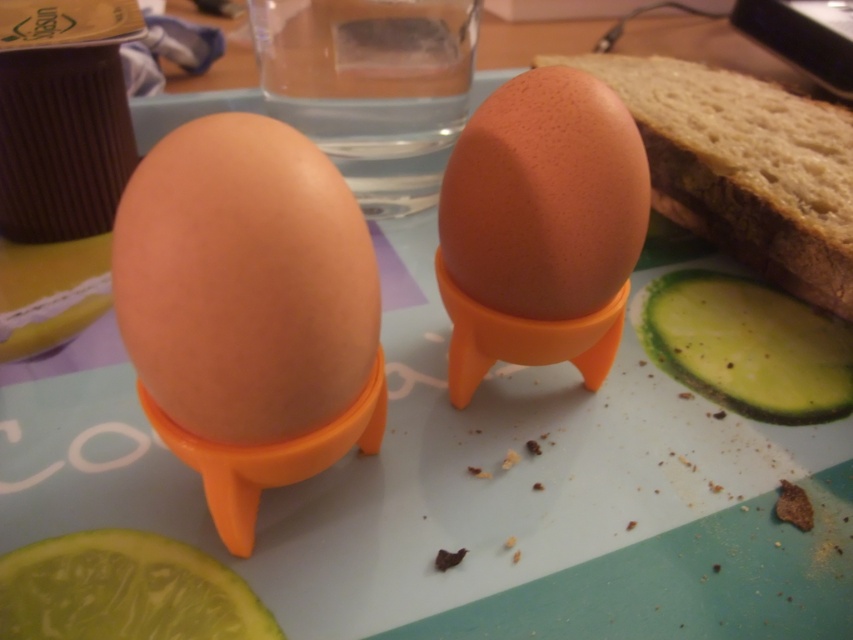
Locate an element on the screen. matte brown egg at center is located at coordinates (244, 282).

Is matte brown egg at center taller than green matte pickle at lower left?

Yes, matte brown egg at center is taller than green matte pickle at lower left.

At what (x,y) coordinates should I click in order to perform the action: click on matte brown egg at center. Please return your answer as a coordinate pair (x, y). The image size is (853, 640). Looking at the image, I should click on (244, 282).

You are a GUI agent. You are given a task and a screenshot of the screen. Output one action in this format:
    pyautogui.click(x=<x>, y=<y>)
    Task: Click on the matte brown egg at center
    The height and width of the screenshot is (640, 853).
    Given the screenshot: What is the action you would take?
    pyautogui.click(x=244, y=282)

Is brown matte egg at center shorter than green matte pickle at lower left?

No.

Does brown matte egg at center lie behind green matte pickle at lower left?

That is True.

The image size is (853, 640). I want to click on brown matte egg at center, so click(544, 196).

Where is `brown matte egg at center`? This screenshot has width=853, height=640. brown matte egg at center is located at coordinates (544, 196).

Can you confirm if brown matte egg at center is bigger than brown matte bread at upper right?

Incorrect, brown matte egg at center is not larger than brown matte bread at upper right.

Which is below, brown matte egg at center or brown matte bread at upper right?

Positioned lower is brown matte egg at center.

Does point (482, 252) lie behind point (843, 268)?

No, (482, 252) is closer to viewer.

Identify the location of brown matte egg at center. The width and height of the screenshot is (853, 640). (544, 196).